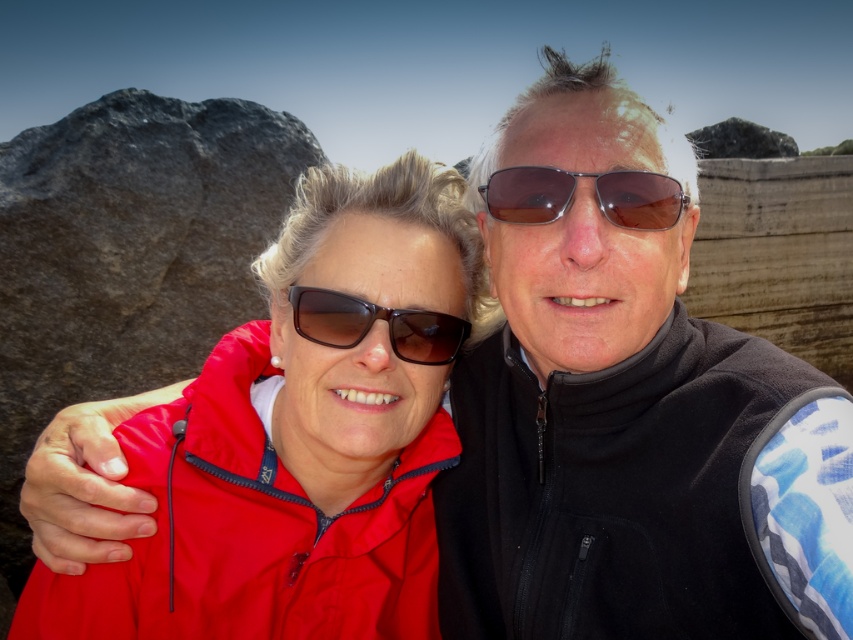
Question: Does black fleece jacket at center have a greater width compared to matte red jacket at center?

Choices:
 (A) yes
 (B) no

Answer: (B)

Question: Which point is closer to the camera taking this photo?

Choices:
 (A) (622, 128)
 (B) (518, 180)

Answer: (A)

Question: Is metallic aviator sunglasses at center thinner than matte black sunglasses at center?

Choices:
 (A) no
 (B) yes

Answer: (B)

Question: Can you confirm if matte red jacket at center is positioned below metallic aviator sunglasses at center?

Choices:
 (A) yes
 (B) no

Answer: (A)

Question: Which point is closer to the camera?

Choices:
 (A) (410, 500)
 (B) (635, 212)

Answer: (B)

Question: Which object appears farthest from the camera in this image?

Choices:
 (A) matte black sunglasses at center
 (B) metallic aviator sunglasses at center
 (C) matte red jacket at center

Answer: (A)